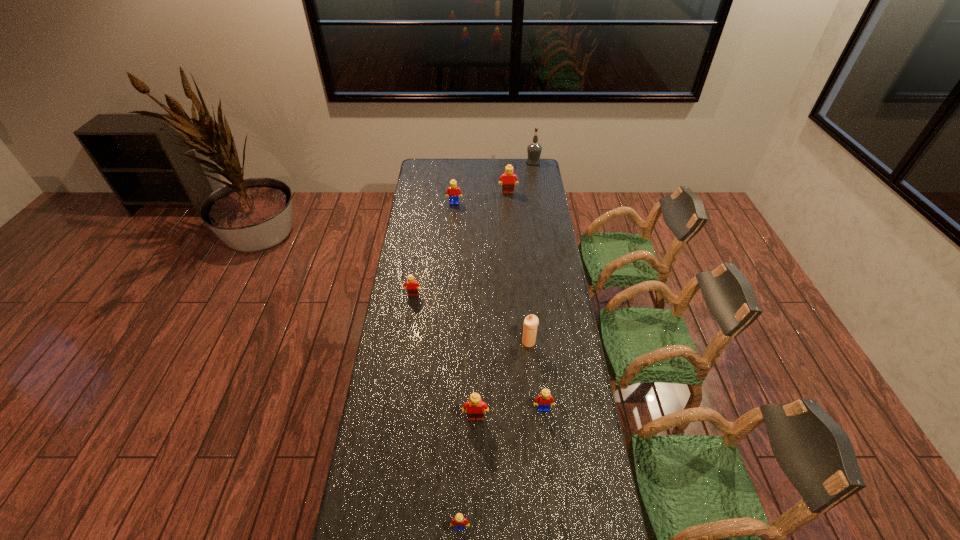
Identify the location of the farthest object. The height and width of the screenshot is (540, 960). (534, 149).

What are the coordinates of `vodka` in the screenshot? It's located at (534, 149).

The image size is (960, 540). I want to click on the rightmost brown Lego, so point(508,177).

The height and width of the screenshot is (540, 960). Identify the location of the farthest Lego. (508, 177).

Where is `candle`? Image resolution: width=960 pixels, height=540 pixels. candle is located at coordinates (531, 322).

The height and width of the screenshot is (540, 960). In order to click on the second Lego from left to right in this screenshot , I will do `click(454, 192)`.

The image size is (960, 540). I want to click on the fifth nearest Lego, so click(454, 192).

Locate an element on the screen. The height and width of the screenshot is (540, 960). the nearest brown Lego is located at coordinates (475, 405).

Identify the location of the fifth farthest Lego. This screenshot has width=960, height=540. (475, 405).

Find the location of `the leftmost object`. the leftmost object is located at coordinates (412, 289).